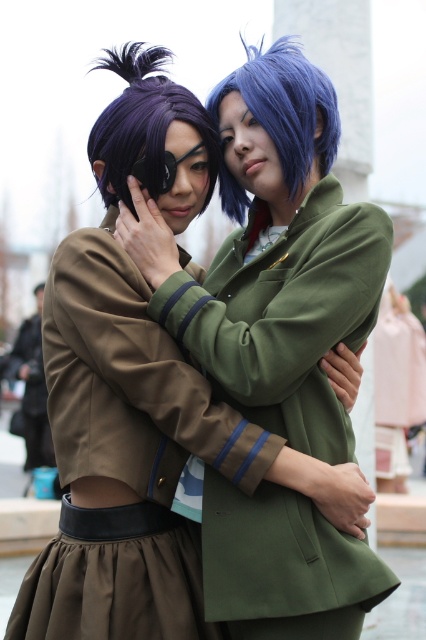
Who is more distant from viewer, (x=302, y=163) or (x=143, y=83)?

The point (x=143, y=83) is more distant.

Between blue matte wig at upper center and purple matte wig at upper left, which one appears on the left side from the viewer's perspective?

purple matte wig at upper left

Is point (213, 100) closer to viewer compared to point (114, 172)?

No, it is behind (114, 172).

Find the location of a particular element. The height and width of the screenshot is (640, 426). blue matte wig at upper center is located at coordinates pos(285,108).

Which of these two, matte brown dress at center or blue matte wig at upper center, stands shorter?

matte brown dress at center is shorter.

Describe the element at coordinates (124, 456) in the screenshot. The image size is (426, 640). I see `matte brown dress at center` at that location.

The width and height of the screenshot is (426, 640). I want to click on matte brown dress at center, so click(124, 456).

Can you confirm if matte brown dress at center is smaller than purple matte wig at upper left?

Yes, matte brown dress at center is smaller than purple matte wig at upper left.

Which is in front, point (97, 282) or point (120, 72)?

Positioned in front is point (97, 282).

Does point (170, 420) lie in front of point (209, 152)?

Yes, it is in front of point (209, 152).

Where is `matte brown dress at center`? This screenshot has width=426, height=640. matte brown dress at center is located at coordinates (124, 456).